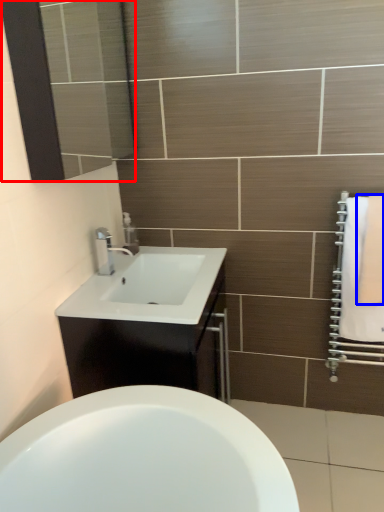
Question: Which object is closer to the camera taking this photo, mirror (highlighted by a red box) or bath towel (highlighted by a blue box)?

Choices:
 (A) mirror
 (B) bath towel

Answer: (A)